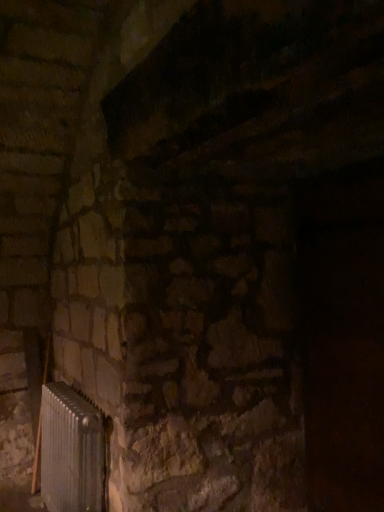
I want to click on silver metallic radiator at lower left, so click(x=71, y=451).

What is the approximate width of silver metallic radiator at lower left?

silver metallic radiator at lower left is 7.94 inches wide.

In order to face silver metallic radiator at lower left, should I rotate leftwards or rightwards?

You should look left and rotate roughly 16.046 degrees.

Describe the element at coordinates (71, 451) in the screenshot. I see `silver metallic radiator at lower left` at that location.

Image resolution: width=384 pixels, height=512 pixels. I want to click on silver metallic radiator at lower left, so click(71, 451).